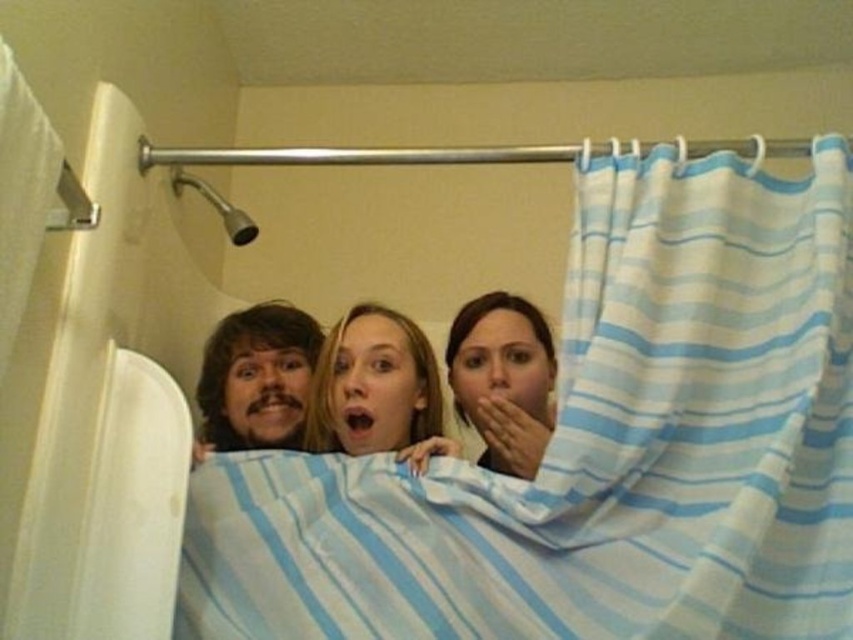
Question: From the image, what is the correct spatial relationship of blue striped fabric at upper center in relation to smooth blue blanket at center?

Choices:
 (A) below
 (B) above

Answer: (B)

Question: Estimate the real-world distances between objects in this image. Which object is farther from the smooth skin face at center?

Choices:
 (A) blue striped fabric at upper center
 (B) white striped shower curtain at left
 (C) brushed metal shower head at upper center
 (D) shaggy brown hair at center

Answer: (B)

Question: Is the position of smooth blue blanket at center more distant than that of smooth skin face at center?

Choices:
 (A) no
 (B) yes

Answer: (A)

Question: Can you confirm if smooth skin face at center is bigger than white striped shower curtain at left?

Choices:
 (A) no
 (B) yes

Answer: (B)

Question: Which point is closer to the camera?

Choices:
 (A) (306, 333)
 (B) (177, 172)
 (C) (10, 173)
 (D) (819, 355)

Answer: (C)

Question: Considering the real-world distances, which object is farthest from the white striped shower curtain at left?

Choices:
 (A) brushed metal shower head at upper center
 (B) blue striped fabric at upper center
 (C) shaggy brown hair at center
 (D) smooth blue blanket at center

Answer: (A)